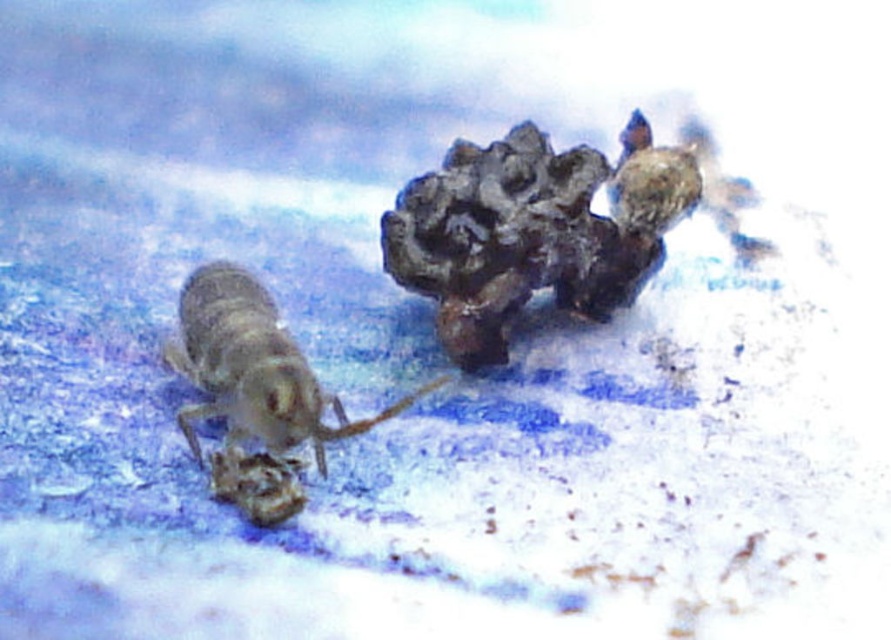
You are an entomologist observing the translucent gray insect at left and the dark brown textured rock at upper right in the image. Based on their positions, which object is closer to the camera?

The dark brown textured rock at upper right is closer to the camera because the translucent gray insect at left is behind it.

You are an entomologist observing the translucent gray insect at left and the dark brown textured rock at upper right. Which object is located to the right of the other?

The dark brown textured rock at upper right is positioned on the right side of the translucent gray insect at left.